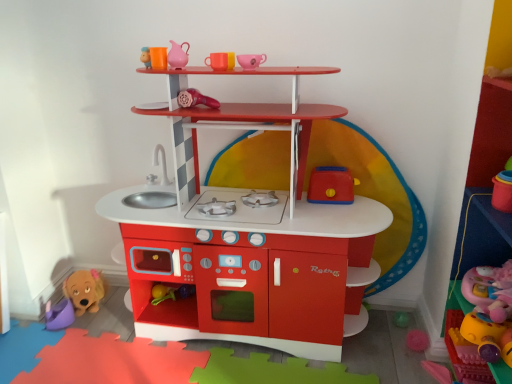
This screenshot has width=512, height=384. Find the location of `unoccupied region to the right of purple plastic bucket at lower left, acting as the 8th toy starting from the right`. unoccupied region to the right of purple plastic bucket at lower left, acting as the 8th toy starting from the right is located at coordinates tap(98, 321).